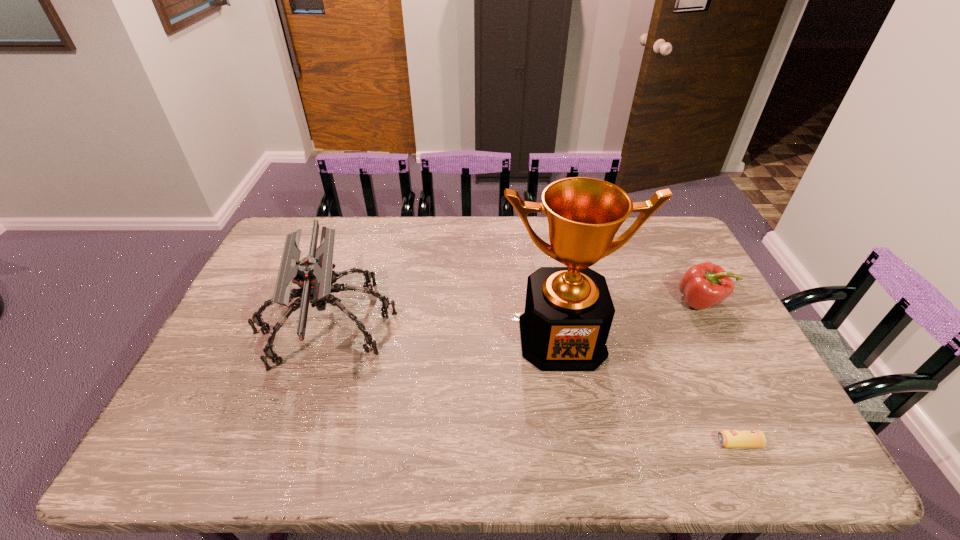
Identify the location of vacant space located 0.170m on the back of the nearest object. (708, 376).

Locate an element on the screen. This screenshot has width=960, height=540. object at the near edge is located at coordinates (727, 438).

You are a GUI agent. You are given a task and a screenshot of the screen. Output one action in this format:
    pyautogui.click(x=<x>, y=<y>)
    Task: Click on the object that is at the left edge
    
    Given the screenshot: What is the action you would take?
    pyautogui.click(x=313, y=274)

This screenshot has height=540, width=960. I want to click on pepper that is at the right edge, so click(x=704, y=285).

Where is `beer can present at the right edge`? The height and width of the screenshot is (540, 960). beer can present at the right edge is located at coordinates (727, 438).

Find the location of `object that is positioned at the near right corner`. object that is positioned at the near right corner is located at coordinates (727, 438).

This screenshot has width=960, height=540. In the image, there is a desktop. What are the coordinates of `vacant space at the far edge` in the screenshot? It's located at (463, 217).

In order to click on vacant space at the near edge in this screenshot , I will do `click(585, 455)`.

Identify the location of free space at the left edge of the desktop. This screenshot has width=960, height=540. click(274, 282).

Locate an element on the screen. free spot at the right edge of the desktop is located at coordinates click(683, 312).